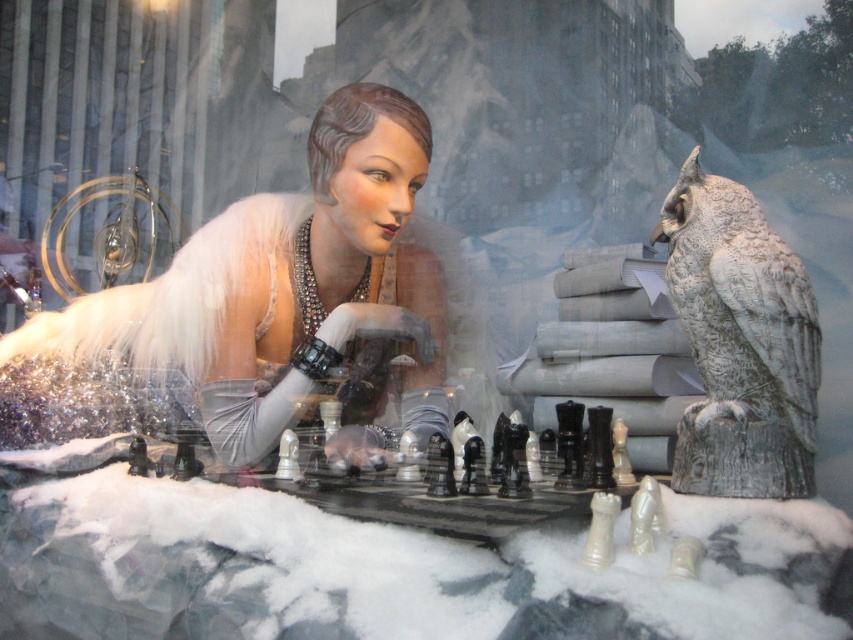
Question: Can you confirm if shiny silver dress at center is smaller than gray stone owl at upper right?

Choices:
 (A) no
 (B) yes

Answer: (A)

Question: Which of the following is the closest to the observer?

Choices:
 (A) gray stone owl at upper right
 (B) shiny silver dress at center

Answer: (A)

Question: Is shiny silver dress at center thinner than gray stone owl at upper right?

Choices:
 (A) no
 (B) yes

Answer: (A)

Question: Which point is closer to the camera?

Choices:
 (A) shiny silver dress at center
 (B) gray stone owl at upper right

Answer: (B)

Question: From the image, what is the correct spatial relationship of shiny silver dress at center in relation to gray stone owl at upper right?

Choices:
 (A) below
 (B) above

Answer: (A)